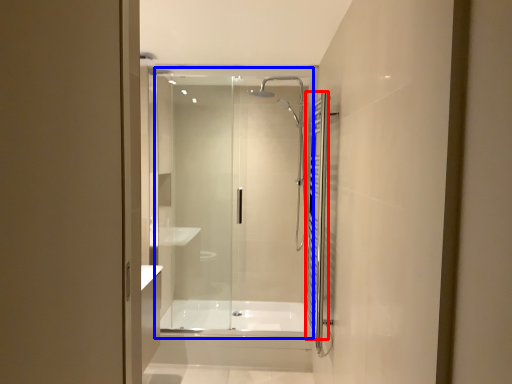
Question: Which point is further to the camera, shower curtain (highlighted by a red box) or glass door (highlighted by a blue box)?

Choices:
 (A) shower curtain
 (B) glass door

Answer: (B)